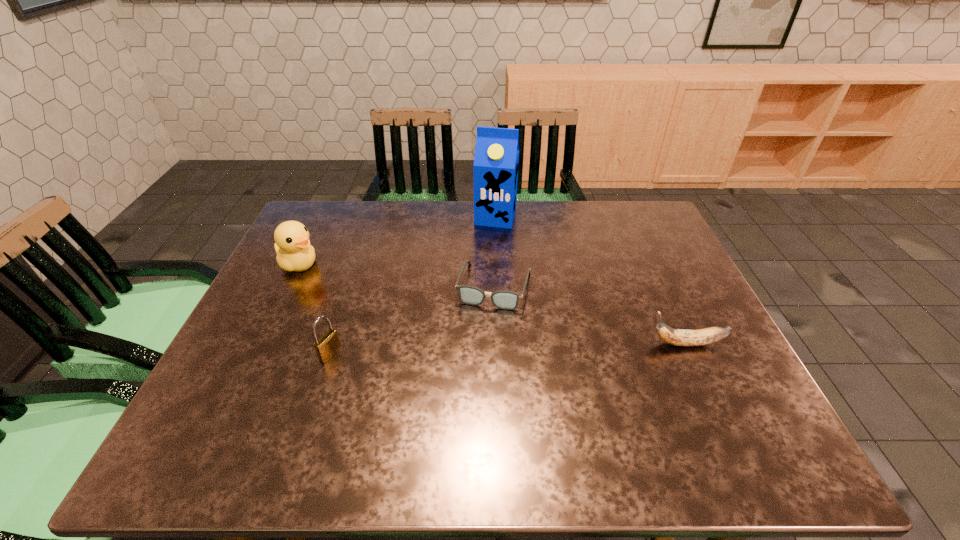
Identify the location of the fourth object from right to left. (328, 345).

The width and height of the screenshot is (960, 540). In order to click on the third tallest object in this screenshot , I will do click(x=328, y=345).

Image resolution: width=960 pixels, height=540 pixels. What are the coordinates of `banana` in the screenshot? It's located at (680, 337).

In order to click on the fourth tallest object in this screenshot , I will do `click(680, 337)`.

The width and height of the screenshot is (960, 540). Find the location of `spectacles`. spectacles is located at coordinates (508, 300).

At what (x,y) coordinates should I click in order to perform the action: click on carton. Please return your answer as a coordinate pair (x, y). The width and height of the screenshot is (960, 540). Looking at the image, I should click on (496, 160).

This screenshot has height=540, width=960. What are the coordinates of `the farthest object` in the screenshot? It's located at (496, 160).

I want to click on the leftmost object, so click(292, 245).

This screenshot has height=540, width=960. Find the location of `duck`. duck is located at coordinates (292, 245).

Image resolution: width=960 pixels, height=540 pixels. What are the coordinates of `free space located 0.390m on the right of the padlock` in the screenshot? It's located at (508, 354).